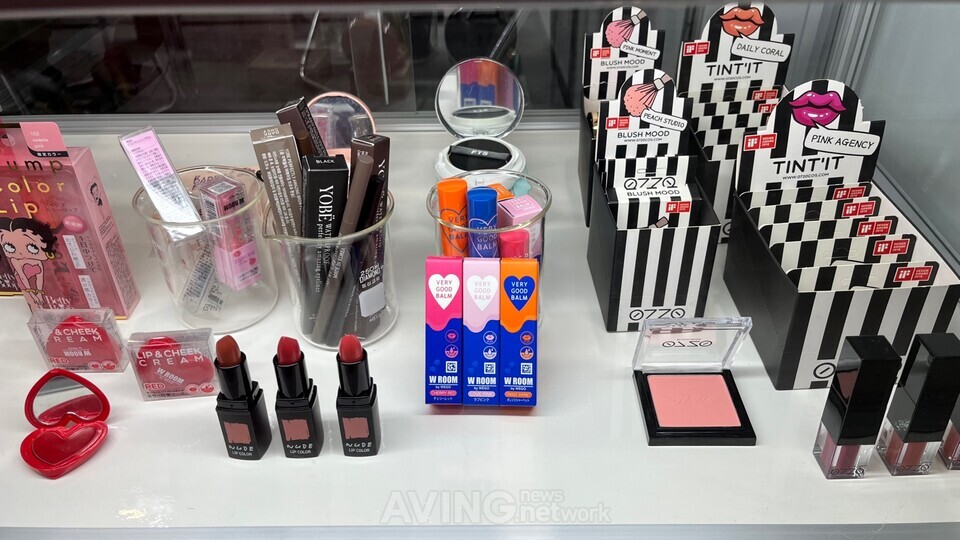
This screenshot has width=960, height=540. Find the location of `glass panes`. glass panes is located at coordinates (930, 118), (245, 60).